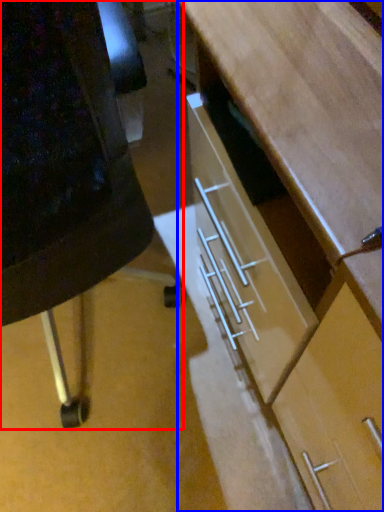
Question: Among these objects, which one is nearest to the camera, furniture (highlighted by a red box) or desk (highlighted by a blue box)?

Choices:
 (A) furniture
 (B) desk

Answer: (A)